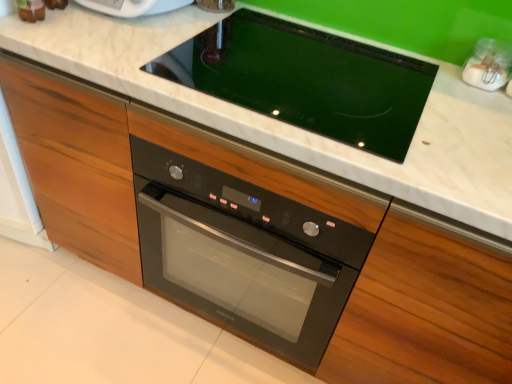
Question: Is black glass oven at center inside the boundaries of black glass cooktop at center, or outside?

Choices:
 (A) inside
 (B) outside

Answer: (B)

Question: In the image, is black glass oven at center positioned in front of or behind black glass cooktop at center?

Choices:
 (A) front
 (B) behind

Answer: (B)

Question: Which object is positioned farthest from the white marble countertop at center?

Choices:
 (A) black glass oven at center
 (B) black glass cooktop at center

Answer: (A)

Question: Which object is positioned farthest from the white marble countertop at center?

Choices:
 (A) black glass cooktop at center
 (B) black glass oven at center

Answer: (B)